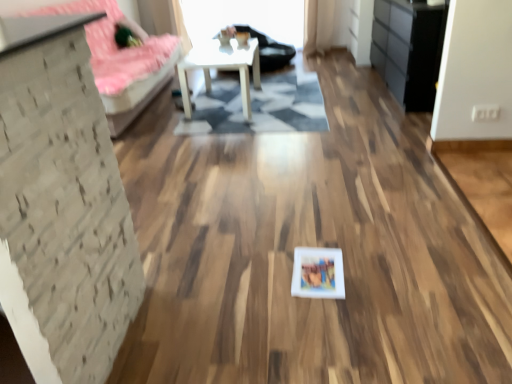
The width and height of the screenshot is (512, 384). What are the coordinates of `free space above matte white picture frame at center (from a real-world perspective)` in the screenshot? It's located at (316, 270).